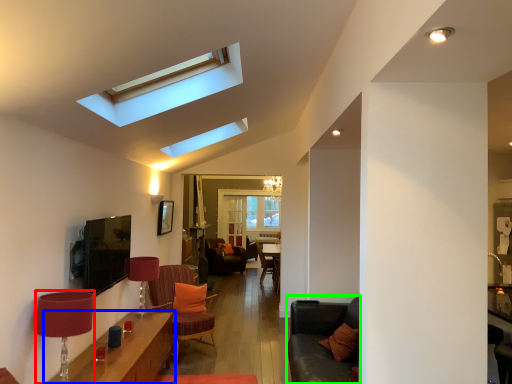
Question: Estimate the real-world distances between objects in this image. Which object is farther from lamp (highlighted by a red box), table (highlighted by a blue box) or couch (highlighted by a green box)?

Choices:
 (A) table
 (B) couch

Answer: (B)